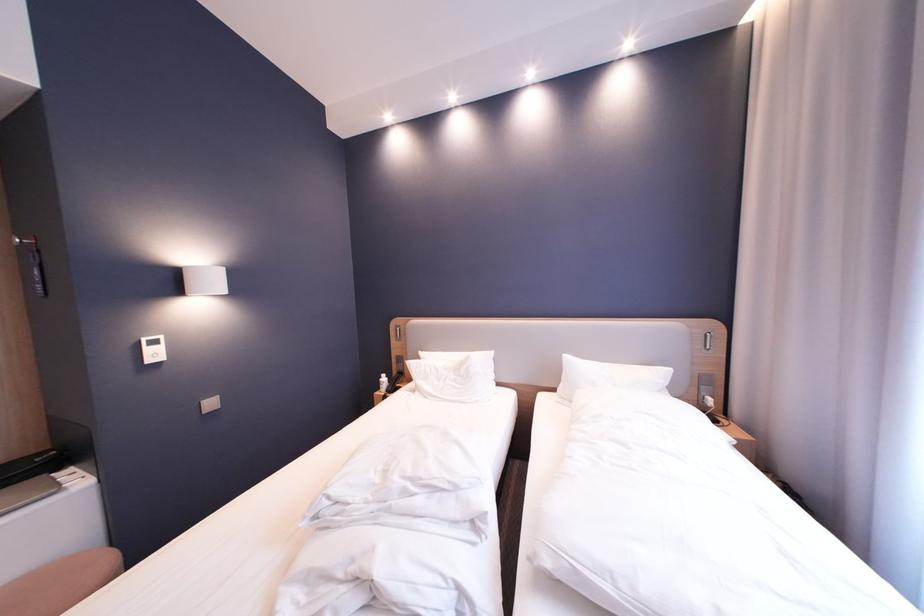
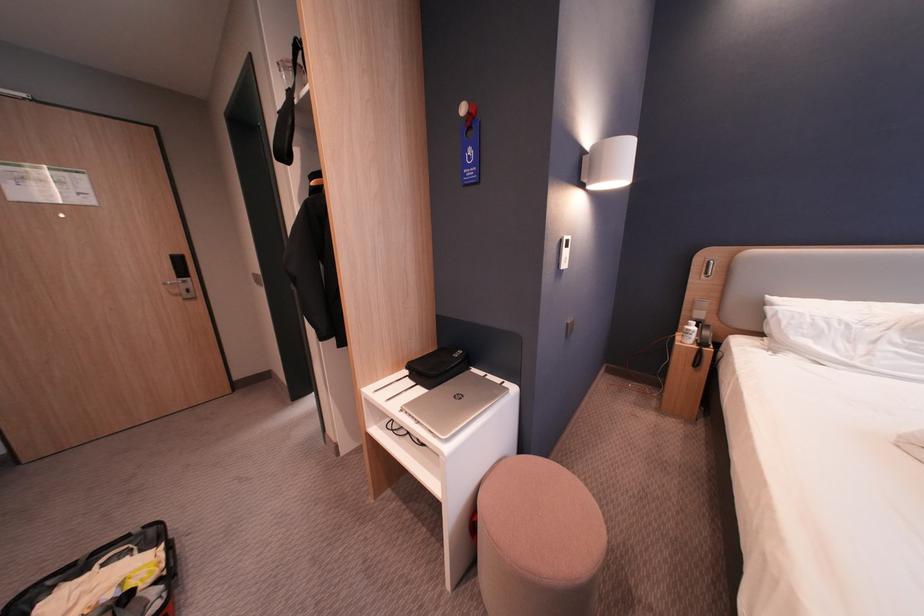
Locate, in the second image, the point that corresponds to pixel 392 379 in the first image.

(698, 328)